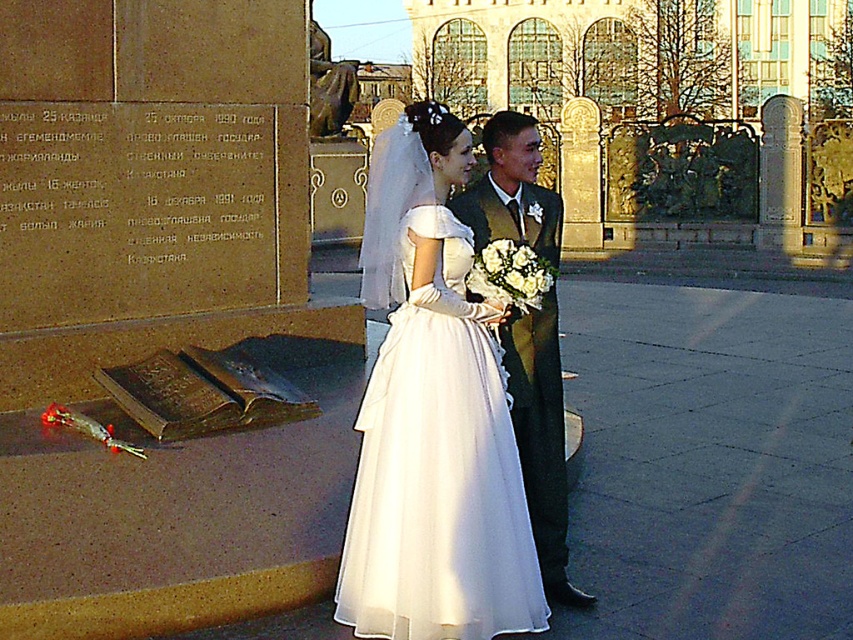
How distant is white tulle dress at center from shiny dark green suit at center?

white tulle dress at center and shiny dark green suit at center are 16.18 inches apart from each other.

Is white tulle dress at center behind shiny dark green suit at center?

That is False.

Is point (430, 424) positioned in front of point (561, 548)?

Yes.

Identify the location of white tulle dress at center. The width and height of the screenshot is (853, 640). (438, 464).